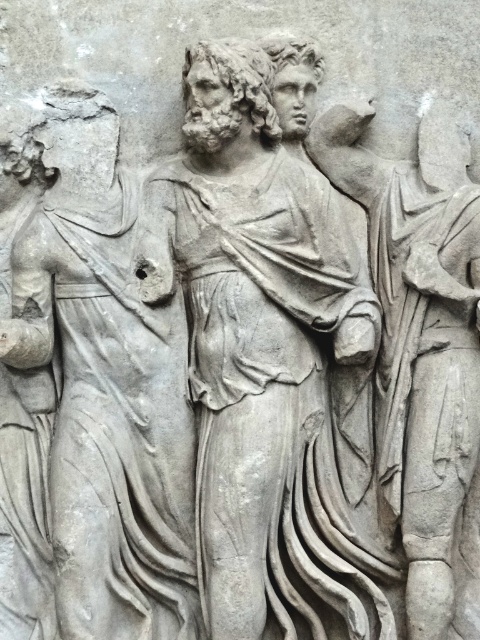
Question: Is gray stone statue at center wider than gray stone figure at left?

Choices:
 (A) no
 (B) yes

Answer: (B)

Question: Among these objects, which one is farthest from the camera?

Choices:
 (A) gray stone figure at left
 (B) gray stone statue at center

Answer: (B)

Question: Which object is farther from the camera taking this photo?

Choices:
 (A) gray stone statue at center
 (B) gray stone figure at left

Answer: (A)

Question: Does gray stone statue at center have a smaller size compared to gray stone figure at left?

Choices:
 (A) yes
 (B) no

Answer: (B)

Question: Is the position of gray stone statue at center more distant than that of gray stone figure at left?

Choices:
 (A) no
 (B) yes

Answer: (B)